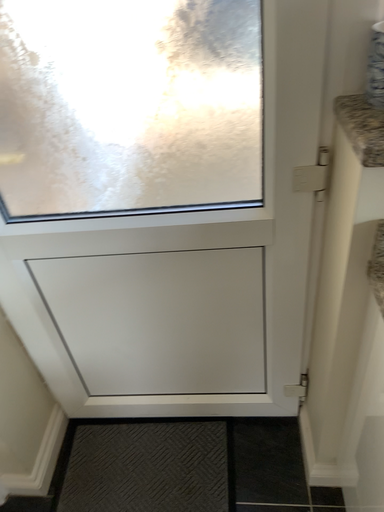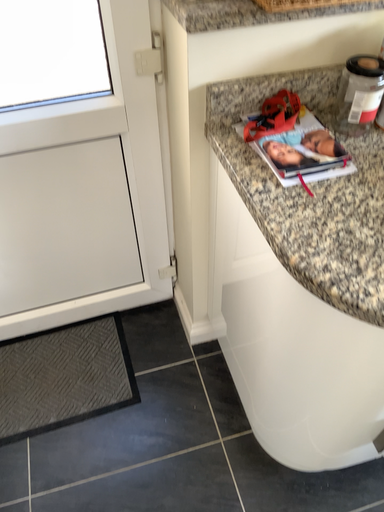
Question: Which way did the camera rotate in the video?

Choices:
 (A) rotated right
 (B) rotated left

Answer: (A)